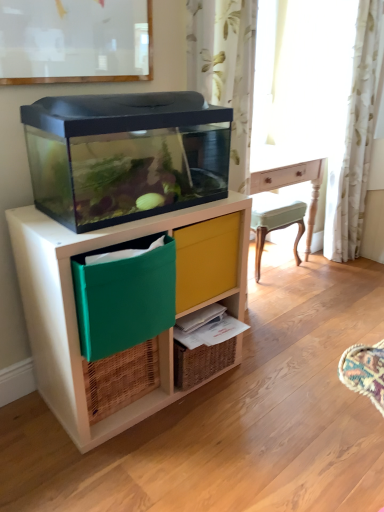
Question: Is woven brown basket at lower left in front of or behind yellow fabric drawer at center in the image?

Choices:
 (A) behind
 (B) front

Answer: (A)

Question: Visually, is woven brown basket at lower left positioned to the left or to the right of yellow fabric drawer at center?

Choices:
 (A) right
 (B) left

Answer: (B)

Question: Which object is the closest to the green fabric storage box at lower left?

Choices:
 (A) yellow fabric drawer at center
 (B) white floral fabric curtain at right
 (C) woven wood shelf at lower center
 (D) transparent plastic aquarium at left
 (E) woven brown basket at lower left

Answer: (D)

Question: Which object is the farthest from the woven brown basket at lower left?

Choices:
 (A) woven wood shelf at lower center
 (B) transparent plastic aquarium at left
 (C) green fabric storage box at lower left
 (D) yellow fabric drawer at center
 (E) white floral fabric curtain at right

Answer: (E)